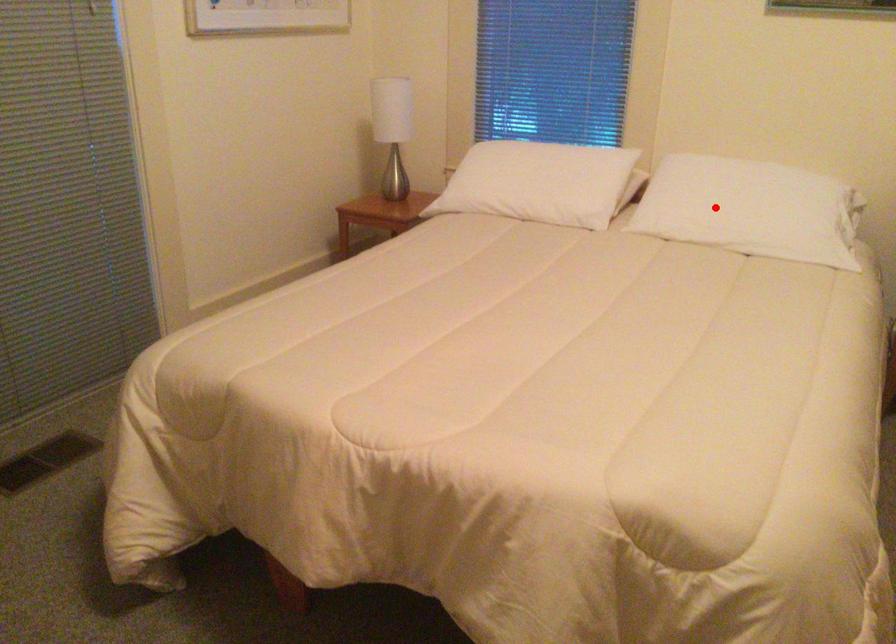
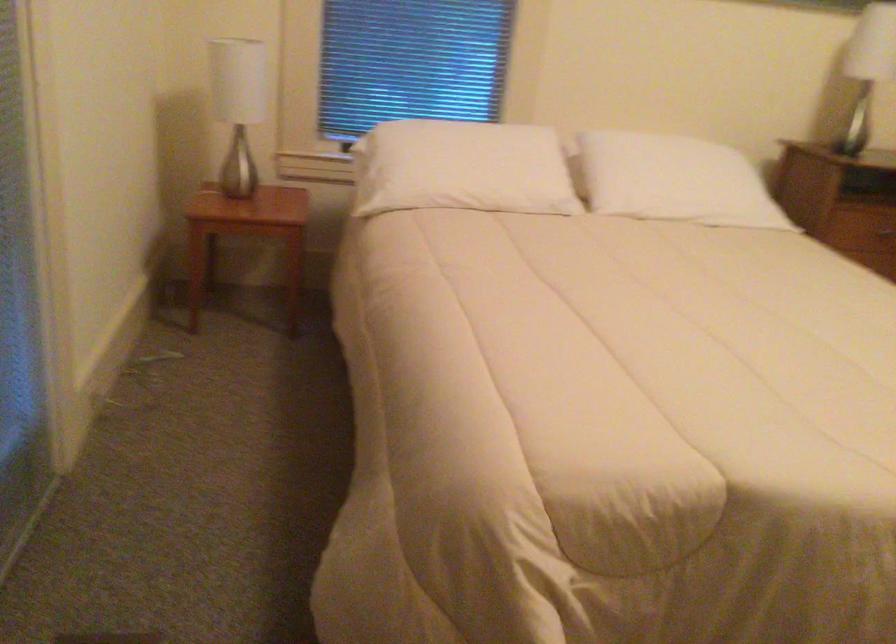
Locate, in the second image, the point that corresponds to the highlighted location in the first image.

(673, 180)